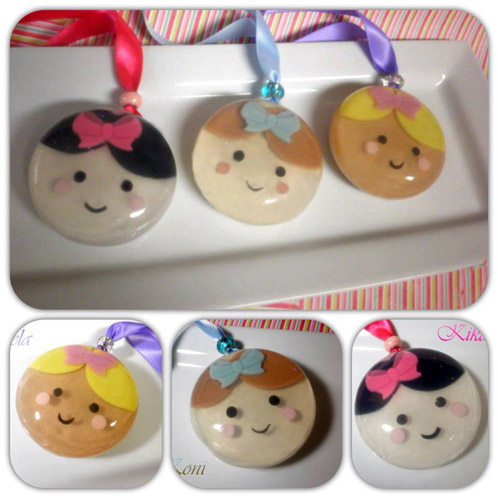
The width and height of the screenshot is (498, 498). In order to click on plate in this screenshot , I will do `click(358, 202)`, `click(122, 465)`, `click(257, 477)`, `click(446, 482)`.